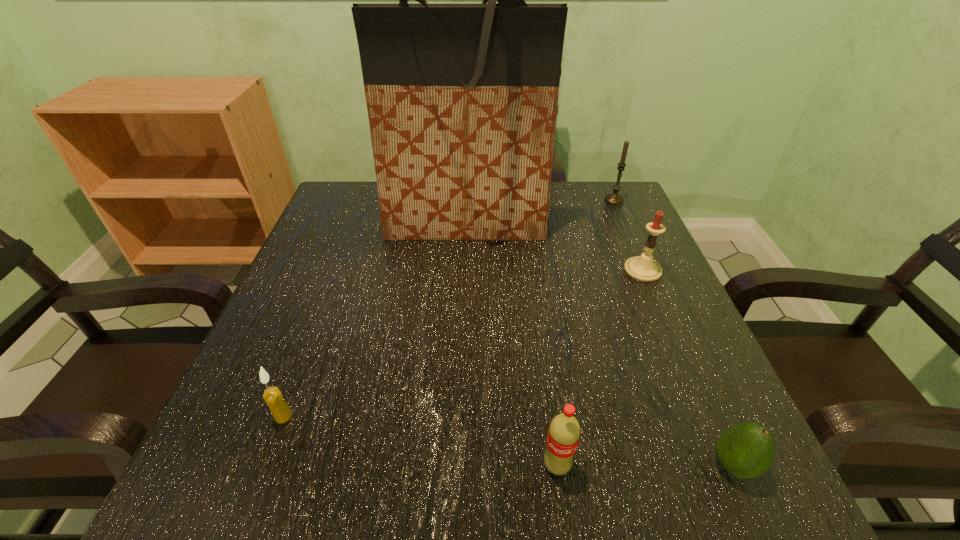
You are a GUI agent. You are given a task and a screenshot of the screen. Output one action in this format:
    pyautogui.click(x=<x>, y=<y>)
    Task: Click on the unoccupied position between the farthest candle and the fourth nearest object
    The height and width of the screenshot is (540, 960).
    Given the screenshot: What is the action you would take?
    pyautogui.click(x=629, y=235)

This screenshot has height=540, width=960. What are the coordinates of `vacant area that lies between the shortest object and the second farthest candle` in the screenshot? It's located at (688, 368).

At what (x,y) coordinates should I click in order to perform the action: click on vacant point located between the farthest candle and the fourth nearest object. Please return your answer as a coordinate pair (x, y). This screenshot has width=960, height=540. Looking at the image, I should click on [629, 235].

At what (x,y) coordinates should I click in order to perform the action: click on empty space that is in between the leftmost object and the avocado. Please return your answer as a coordinate pair (x, y). This screenshot has height=540, width=960. Looking at the image, I should click on (508, 441).

Identify the location of unoccupied position between the avocado and the soda. (645, 465).

Locate an element on the screen. Image resolution: width=960 pixels, height=540 pixels. free space between the farthest candle and the fourth nearest object is located at coordinates (629, 235).

Image resolution: width=960 pixels, height=540 pixels. I want to click on object that ranks as the closest to the soda, so click(x=746, y=450).

The width and height of the screenshot is (960, 540). Identify the location of object identified as the fifth closest to the soda. (614, 198).

Identify which candle is the third closest to the avocado. Please provide its 2D coordinates. Your answer should be formatted as a tuple, i.e. [(x, y)], where the tuple contains the x and y coordinates of a point satisfying the conditions above.

[(614, 198)]

At what (x,y) coordinates should I click in order to perform the action: click on the closest candle to the farthest candle. Please return your answer as a coordinate pair (x, y). Looking at the image, I should click on (643, 268).